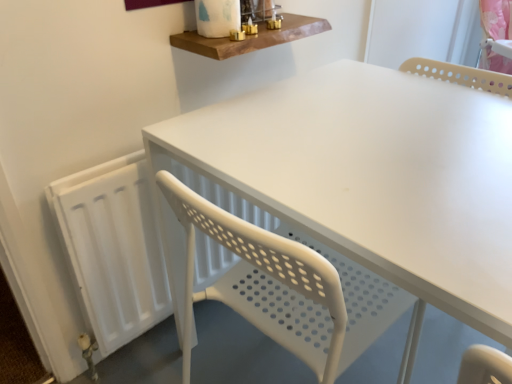
Question: Does wooden shelf at upper center have a lesser height compared to white matte radiator at left?

Choices:
 (A) yes
 (B) no

Answer: (A)

Question: Considering the relative sizes of wooden shelf at upper center and white matte radiator at left in the image provided, is wooden shelf at upper center bigger than white matte radiator at left?

Choices:
 (A) yes
 (B) no

Answer: (B)

Question: Is wooden shelf at upper center smaller than white matte radiator at left?

Choices:
 (A) yes
 (B) no

Answer: (A)

Question: Is wooden shelf at upper center to the right of white matte radiator at left from the viewer's perspective?

Choices:
 (A) no
 (B) yes

Answer: (B)

Question: Is wooden shelf at upper center not within white matte radiator at left?

Choices:
 (A) yes
 (B) no

Answer: (A)

Question: In the image, is white matte radiator at left positioned in front of or behind white matte table at center?

Choices:
 (A) front
 (B) behind

Answer: (B)

Question: Is white matte radiator at left situated inside white matte table at center or outside?

Choices:
 (A) outside
 (B) inside

Answer: (A)

Question: Visually, is white matte radiator at left positioned to the left or to the right of white matte table at center?

Choices:
 (A) right
 (B) left

Answer: (B)

Question: Based on their sizes in the image, would you say white matte radiator at left is bigger or smaller than white matte table at center?

Choices:
 (A) big
 (B) small

Answer: (B)

Question: Based on their sizes in the image, would you say white matte radiator at left is bigger or smaller than wooden shelf at upper center?

Choices:
 (A) small
 (B) big

Answer: (B)

Question: Is white matte radiator at left inside or outside of wooden shelf at upper center?

Choices:
 (A) outside
 (B) inside

Answer: (A)

Question: From the image's perspective, relative to wooden shelf at upper center, is white matte radiator at left above or below?

Choices:
 (A) below
 (B) above

Answer: (A)

Question: In terms of width, does white matte radiator at left look wider or thinner when compared to wooden shelf at upper center?

Choices:
 (A) wide
 (B) thin

Answer: (B)

Question: Do you think white matte table at center is within white matte radiator at left, or outside of it?

Choices:
 (A) inside
 (B) outside

Answer: (B)

Question: From the image's perspective, is white matte table at center positioned above or below white matte radiator at left?

Choices:
 (A) below
 (B) above

Answer: (A)